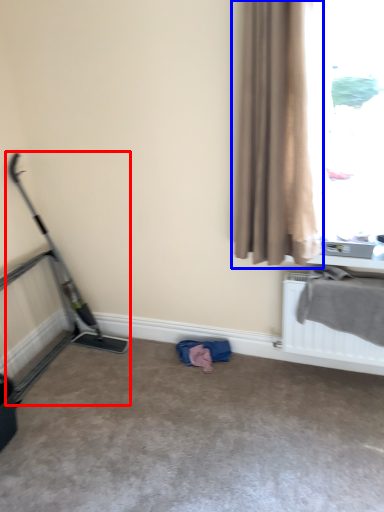
Question: Among these objects, which one is farthest to the camera, baby carriage (highlighted by a red box) or curtain (highlighted by a blue box)?

Choices:
 (A) baby carriage
 (B) curtain

Answer: (A)